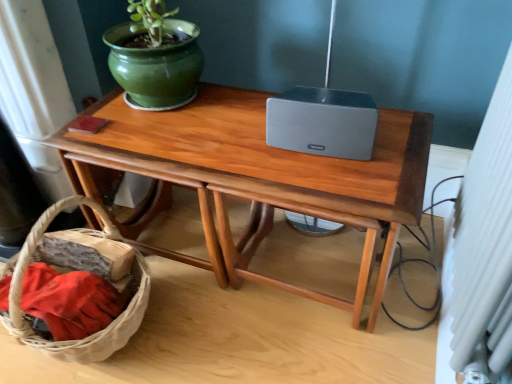
Question: Does woven brown basket at lower left have a greater width compared to wooden table at center?

Choices:
 (A) no
 (B) yes

Answer: (A)

Question: From the image's perspective, is woven brown basket at lower left on wooden table at center?

Choices:
 (A) no
 (B) yes

Answer: (A)

Question: Does woven brown basket at lower left have a larger size compared to wooden table at center?

Choices:
 (A) yes
 (B) no

Answer: (B)

Question: Considering the relative positions of woven brown basket at lower left and wooden table at center in the image provided, is woven brown basket at lower left in front of wooden table at center?

Choices:
 (A) yes
 (B) no

Answer: (A)

Question: From a real-world perspective, is woven brown basket at lower left below wooden table at center?

Choices:
 (A) no
 (B) yes

Answer: (B)

Question: Does woven brown basket at lower left appear on the left side of wooden table at center?

Choices:
 (A) no
 (B) yes

Answer: (B)

Question: Is woven brown basket at lower left not inside green glossy flowerpot at upper left?

Choices:
 (A) no
 (B) yes

Answer: (B)

Question: Is green glossy flowerpot at upper left a part of woven brown basket at lower left?

Choices:
 (A) no
 (B) yes

Answer: (A)

Question: Can you confirm if woven brown basket at lower left is smaller than green glossy flowerpot at upper left?

Choices:
 (A) yes
 (B) no

Answer: (B)

Question: Does woven brown basket at lower left turn towards green glossy flowerpot at upper left?

Choices:
 (A) yes
 (B) no

Answer: (B)

Question: Considering the relative sizes of woven brown basket at lower left and green glossy flowerpot at upper left in the image provided, is woven brown basket at lower left bigger than green glossy flowerpot at upper left?

Choices:
 (A) yes
 (B) no

Answer: (A)

Question: Is woven brown basket at lower left to the right of green glossy flowerpot at upper left from the viewer's perspective?

Choices:
 (A) yes
 (B) no

Answer: (B)

Question: Can you confirm if green glossy flowerpot at upper left is positioned to the right of wooden table at center?

Choices:
 (A) no
 (B) yes

Answer: (A)